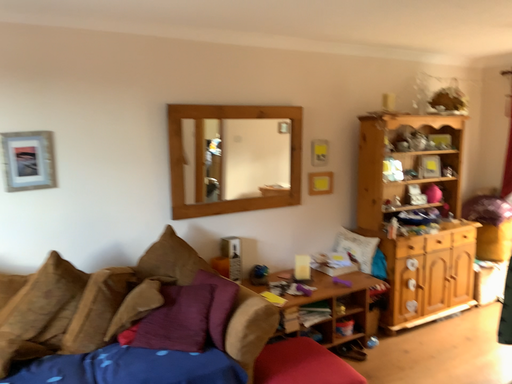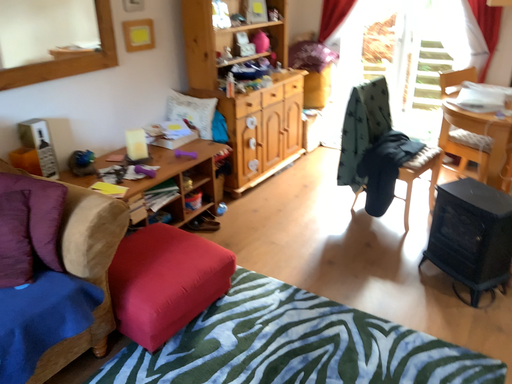
Question: How did the camera likely rotate when shooting the video?

Choices:
 (A) rotated left
 (B) rotated right

Answer: (B)